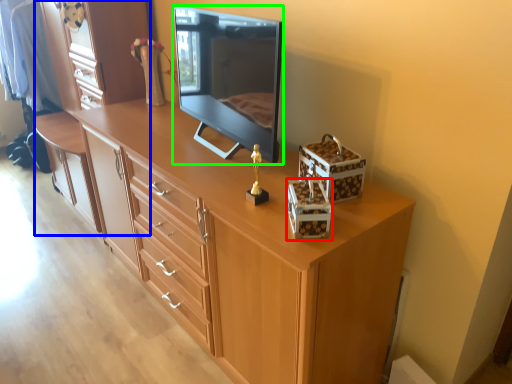
Question: Considering the real-world distances, which object is closest to storage box (highlighted by a red box)? dresser (highlighted by a blue box) or television (highlighted by a green box).

Choices:
 (A) dresser
 (B) television

Answer: (B)